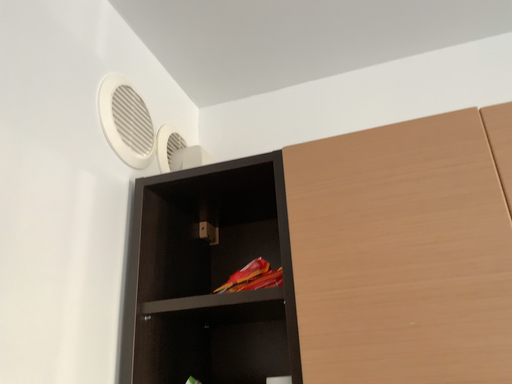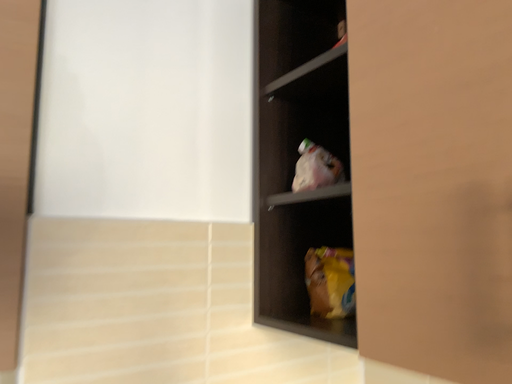
Question: How did the camera likely rotate when shooting the video?

Choices:
 (A) rotated upward
 (B) rotated downward

Answer: (B)